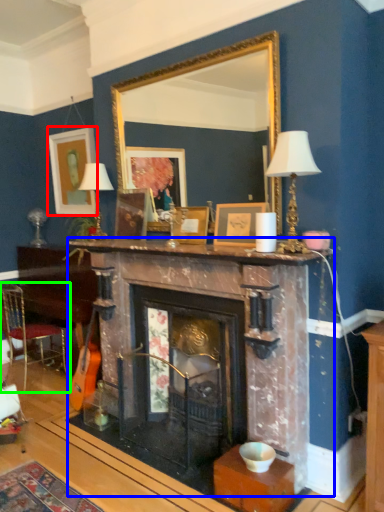
Question: Which object is positioned farthest from picture frame (highlighted by a red box)? Select from fireplace (highlighted by a blue box) and chair (highlighted by a green box).

Choices:
 (A) fireplace
 (B) chair

Answer: (A)